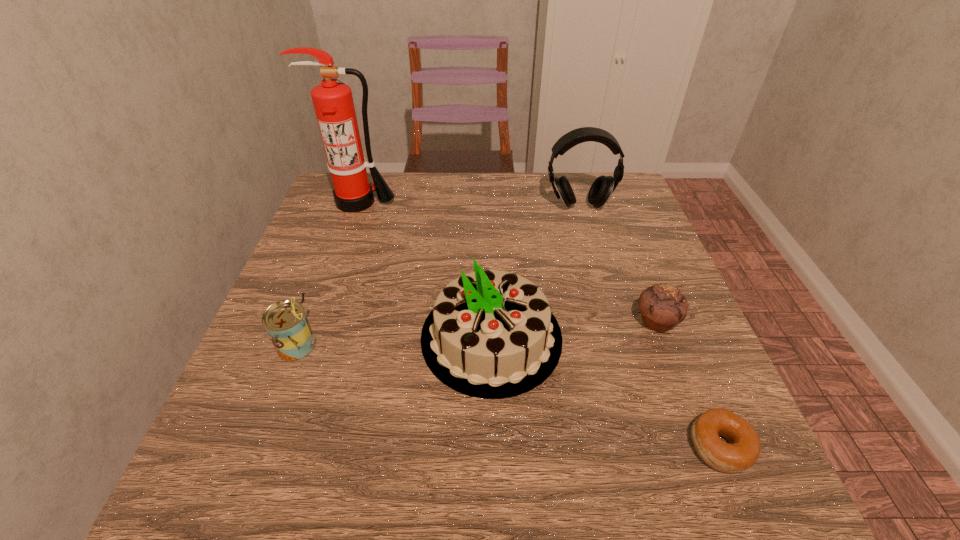
Find the location of a particular element. The width and height of the screenshot is (960, 540). object that is the second closest to the can is located at coordinates 333,102.

Locate an element on the screen. The image size is (960, 540). object that ranks as the fourth closest to the fourth object from right to left is located at coordinates (602, 188).

This screenshot has height=540, width=960. In order to click on blank area in the image that satisfies the following two spatial constraints: 1. on the front side of the muffin; 2. on the right side of the bagel in this screenshot , I will do `click(706, 446)`.

In order to click on vacant space that satisfies the following two spatial constraints: 1. on the ear cups of the earphone; 2. on the left side of the fifth tallest object in this screenshot , I will do `click(612, 321)`.

The image size is (960, 540). I want to click on vacant point that satisfies the following two spatial constraints: 1. on the back side of the birthday cake; 2. on the left side of the muffin, so click(x=491, y=321).